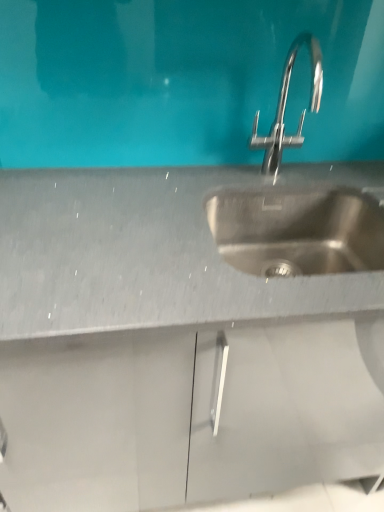
The image size is (384, 512). I want to click on stainless steel sink at center, the 2th sink viewed from the top, so click(297, 230).

Measure the distance between stainless steel sink at center, the 2th sink viewed from the top, and camera.

The distance of stainless steel sink at center, the 2th sink viewed from the top, from camera is 93.10 centimeters.

The width and height of the screenshot is (384, 512). What do you see at coordinates (297, 230) in the screenshot?
I see `stainless steel sink at center, arranged as the first sink when ordered from the bottom` at bounding box center [297, 230].

Describe the element at coordinates (298, 231) in the screenshot. Image resolution: width=384 pixels, height=512 pixels. I see `satin nickel faucet at upper center, the 1th sink viewed from the top` at that location.

The height and width of the screenshot is (512, 384). In order to click on satin nickel faucet at upper center, which ranks as the 2th sink in bottom-to-top order in this screenshot , I will do `click(298, 231)`.

Where is `stainless steel sink at center, arranged as the first sink when ordered from the bottom`? Image resolution: width=384 pixels, height=512 pixels. stainless steel sink at center, arranged as the first sink when ordered from the bottom is located at coordinates (297, 230).

Is satin nickel faucet at upper center, which ranks as the 2th sink in bottom-to-top order, at the left side of stainless steel sink at center, arranged as the first sink when ordered from the bottom?

Yes.

Is satin nickel faucet at upper center, the 1th sink viewed from the top, closer to camera compared to stainless steel sink at center, the 2th sink viewed from the top?

That is True.

Considering the positions of point (383, 213) and point (292, 240), is point (383, 213) closer or farther from the camera than point (292, 240)?

Point (383, 213) appears to be closer to the viewer than point (292, 240).

From the image's perspective, which one is positioned lower, satin nickel faucet at upper center, the 1th sink viewed from the top, or stainless steel sink at center, arranged as the first sink when ordered from the bottom?

stainless steel sink at center, arranged as the first sink when ordered from the bottom, is shown below in the image.

From a real-world perspective, is satin nickel faucet at upper center, the 1th sink viewed from the top, located beneath stainless steel sink at center, arranged as the first sink when ordered from the bottom?

No.

Which object is wider, satin nickel faucet at upper center, the 1th sink viewed from the top, or stainless steel sink at center, the 2th sink viewed from the top?

Wider between the two is stainless steel sink at center, the 2th sink viewed from the top.

Is satin nickel faucet at upper center, which ranks as the 2th sink in bottom-to-top order, shorter than stainless steel sink at center, arranged as the first sink when ordered from the bottom?

Incorrect, the height of satin nickel faucet at upper center, which ranks as the 2th sink in bottom-to-top order, does not fall short of that of stainless steel sink at center, arranged as the first sink when ordered from the bottom.

Considering the relative sizes of satin nickel faucet at upper center, the 1th sink viewed from the top, and stainless steel sink at center, the 2th sink viewed from the top, in the image provided, is satin nickel faucet at upper center, the 1th sink viewed from the top, smaller than stainless steel sink at center, the 2th sink viewed from the top,?

Indeed, satin nickel faucet at upper center, the 1th sink viewed from the top, has a smaller size compared to stainless steel sink at center, the 2th sink viewed from the top.

Do you think satin nickel faucet at upper center, the 1th sink viewed from the top, is within stainless steel sink at center, arranged as the first sink when ordered from the bottom, or outside of it?

satin nickel faucet at upper center, the 1th sink viewed from the top, is not inside stainless steel sink at center, arranged as the first sink when ordered from the bottom, it's outside.

Is satin nickel faucet at upper center, which ranks as the 2th sink in bottom-to-top order, aimed at stainless steel sink at center, the 2th sink viewed from the top?

No.

Can you tell me how much satin nickel faucet at upper center, which ranks as the 2th sink in bottom-to-top order, and stainless steel sink at center, arranged as the first sink when ordered from the bottom, differ in facing direction?

The facing directions of satin nickel faucet at upper center, which ranks as the 2th sink in bottom-to-top order, and stainless steel sink at center, arranged as the first sink when ordered from the bottom, are 0.000985 degrees apart.

This screenshot has width=384, height=512. Identify the location of sink on the left of stainless steel sink at center, the 2th sink viewed from the top. (298, 231).

Considering the positions of objects stainless steel sink at center, arranged as the first sink when ordered from the bottom, and satin nickel faucet at upper center, which ranks as the 2th sink in bottom-to-top order, in the image provided, who is more to the right, stainless steel sink at center, arranged as the first sink when ordered from the bottom, or satin nickel faucet at upper center, which ranks as the 2th sink in bottom-to-top order,?

From the viewer's perspective, stainless steel sink at center, arranged as the first sink when ordered from the bottom, appears more on the right side.

Is stainless steel sink at center, the 2th sink viewed from the top, positioned before satin nickel faucet at upper center, which ranks as the 2th sink in bottom-to-top order?

No, it is not.

Does point (325, 226) come farther from viewer compared to point (351, 231)?

Yes, it is behind point (351, 231).

From the image's perspective, is stainless steel sink at center, the 2th sink viewed from the top, under satin nickel faucet at upper center, which ranks as the 2th sink in bottom-to-top order?

Indeed, from the image's perspective, stainless steel sink at center, the 2th sink viewed from the top, is shown beneath satin nickel faucet at upper center, which ranks as the 2th sink in bottom-to-top order.

From a real-world perspective, does stainless steel sink at center, the 2th sink viewed from the top, sit lower than satin nickel faucet at upper center, which ranks as the 2th sink in bottom-to-top order?

Yes, from a real-world perspective, stainless steel sink at center, the 2th sink viewed from the top, is below satin nickel faucet at upper center, which ranks as the 2th sink in bottom-to-top order.

Which object is thinner, stainless steel sink at center, the 2th sink viewed from the top, or satin nickel faucet at upper center, the 1th sink viewed from the top?

With smaller width is satin nickel faucet at upper center, the 1th sink viewed from the top.

Is stainless steel sink at center, the 2th sink viewed from the top, shorter than satin nickel faucet at upper center, which ranks as the 2th sink in bottom-to-top order?

Yes, stainless steel sink at center, the 2th sink viewed from the top, is shorter than satin nickel faucet at upper center, which ranks as the 2th sink in bottom-to-top order.

Is stainless steel sink at center, arranged as the first sink when ordered from the bottom, bigger or smaller than satin nickel faucet at upper center, which ranks as the 2th sink in bottom-to-top order?

In the image, stainless steel sink at center, arranged as the first sink when ordered from the bottom, appears to be larger than satin nickel faucet at upper center, which ranks as the 2th sink in bottom-to-top order.

Is stainless steel sink at center, arranged as the first sink when ordered from the bottom, outside of satin nickel faucet at upper center, the 1th sink viewed from the top?

That's correct, stainless steel sink at center, arranged as the first sink when ordered from the bottom, is outside of satin nickel faucet at upper center, the 1th sink viewed from the top.

Are stainless steel sink at center, arranged as the first sink when ordered from the bottom, and satin nickel faucet at upper center, which ranks as the 2th sink in bottom-to-top order, located far from each other?

No, stainless steel sink at center, arranged as the first sink when ordered from the bottom, is in close proximity to satin nickel faucet at upper center, which ranks as the 2th sink in bottom-to-top order.

Could you tell me if stainless steel sink at center, the 2th sink viewed from the top, is facing satin nickel faucet at upper center, the 1th sink viewed from the top?

No.

What's the angular difference between stainless steel sink at center, arranged as the first sink when ordered from the bottom, and satin nickel faucet at upper center, which ranks as the 2th sink in bottom-to-top order,'s facing directions?

They differ by 0.000985 degrees in their facing directions.

The image size is (384, 512). I want to click on sink behind the satin nickel faucet at upper center, which ranks as the 2th sink in bottom-to-top order, so click(x=297, y=230).

I want to click on sink above the stainless steel sink at center, the 2th sink viewed from the top (from the image's perspective), so click(298, 231).

Image resolution: width=384 pixels, height=512 pixels. Find the location of `sink below the satin nickel faucet at upper center, the 1th sink viewed from the top (from a real-world perspective)`. sink below the satin nickel faucet at upper center, the 1th sink viewed from the top (from a real-world perspective) is located at coordinates (297, 230).